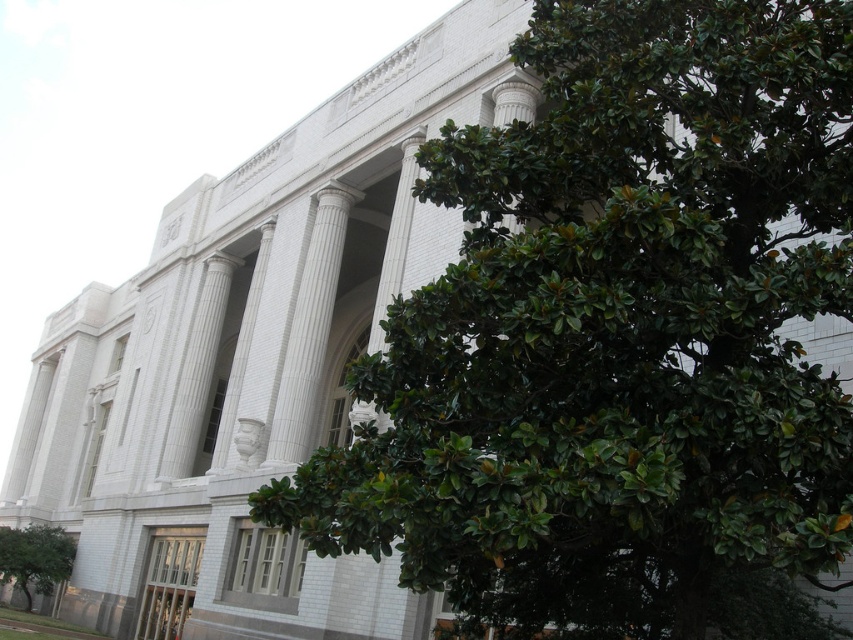
Question: In this image, where is green leafy tree at center located relative to green leafy tree at lower left?

Choices:
 (A) below
 (B) above

Answer: (B)

Question: From the image, what is the correct spatial relationship of green leafy tree at center in relation to green leafy tree at lower left?

Choices:
 (A) left
 (B) right

Answer: (B)

Question: Does green leafy tree at center appear on the left side of green leafy tree at lower left?

Choices:
 (A) yes
 (B) no

Answer: (B)

Question: Which point is farther from the camera taking this photo?

Choices:
 (A) (53, 579)
 (B) (799, 45)

Answer: (A)

Question: Among these objects, which one is farthest from the camera?

Choices:
 (A) green leafy tree at lower left
 (B) green leafy tree at center

Answer: (A)